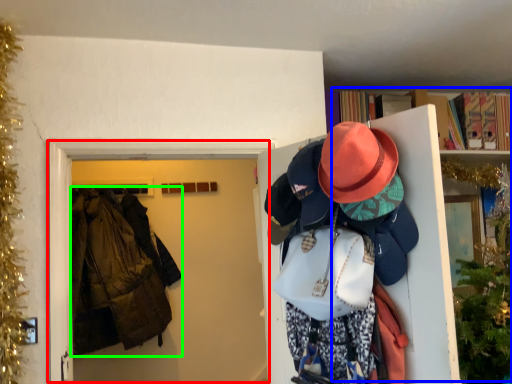
Question: Estimate the real-world distances between objects in this image. Which object is farther from door (highlighted by a red box), bookcase (highlighted by a blue box) or jacket (highlighted by a green box)?

Choices:
 (A) bookcase
 (B) jacket

Answer: (A)